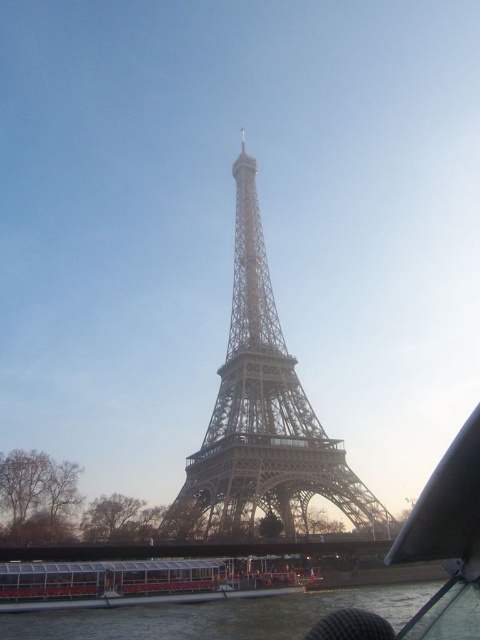
You are a photographer trying to capture the Eiffel Tower from a boat on the Seine River. You notice the transparent glass water at lower center and the white plastic boat at lower center. Which object would you focus on to ensure the Eiffel Tower remains in the background?

The transparent glass water at lower center might be wider than the white plastic boat at lower center, so focusing on the white plastic boat at lower center would keep the Eiffel Tower in the background as it is closer to the photographer.

You are on a boat tour of the Seine River in Paris. You notice the transparent glass water at lower center and the white plastic boat at lower center. Which object is positioned to the right side of the other?

The transparent glass water at lower center is to the right of the white plastic boat at lower center.